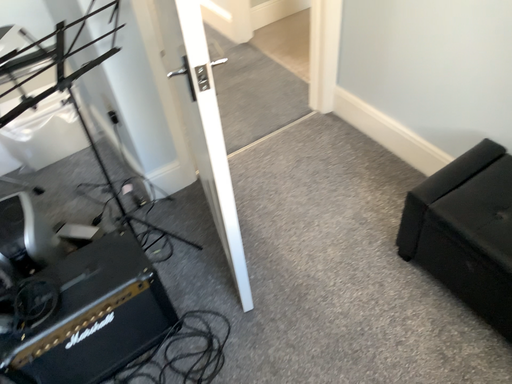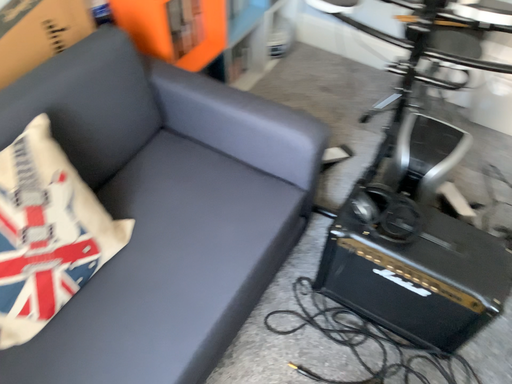
Question: How did the camera likely rotate when shooting the video?

Choices:
 (A) rotated upward
 (B) rotated downward

Answer: (A)